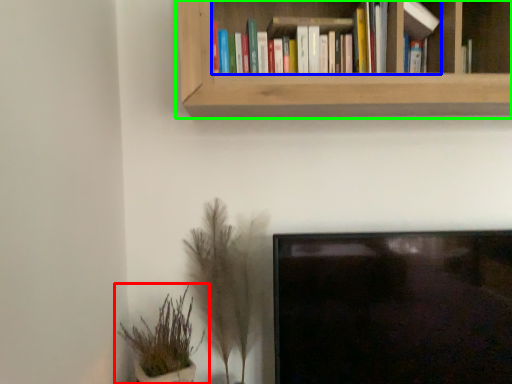
Question: Which object is the farthest from houseplant (highlighted by a red box)? Choose among these: book (highlighted by a blue box) or bookcase (highlighted by a green box).

Choices:
 (A) book
 (B) bookcase

Answer: (A)